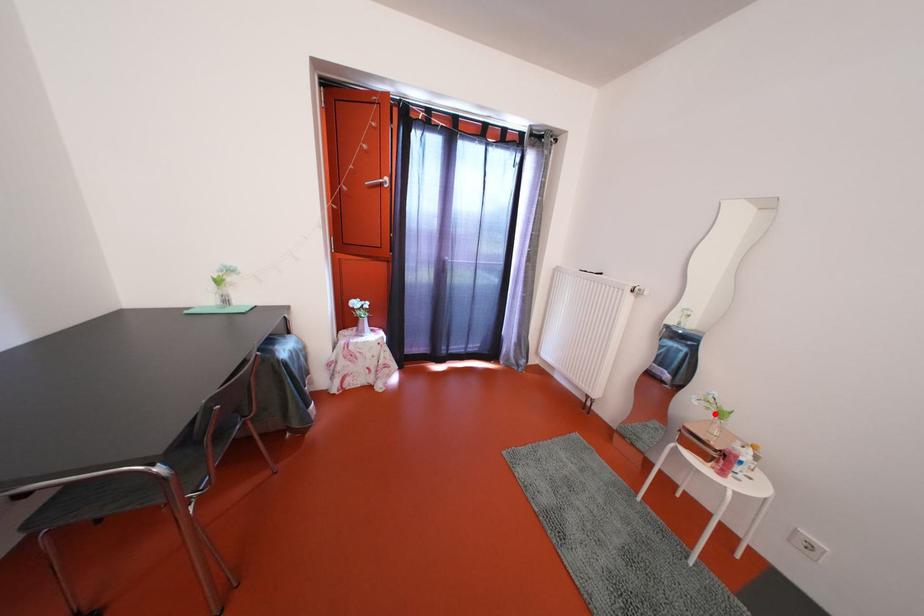
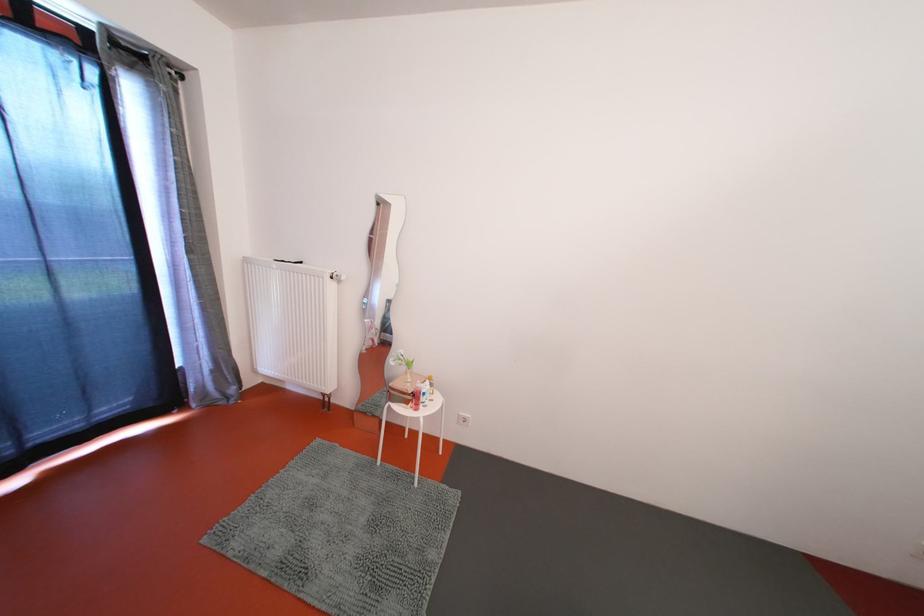
The point at the highlighted location is marked in the first image. Where is the corresponding point in the second image?

(407, 370)